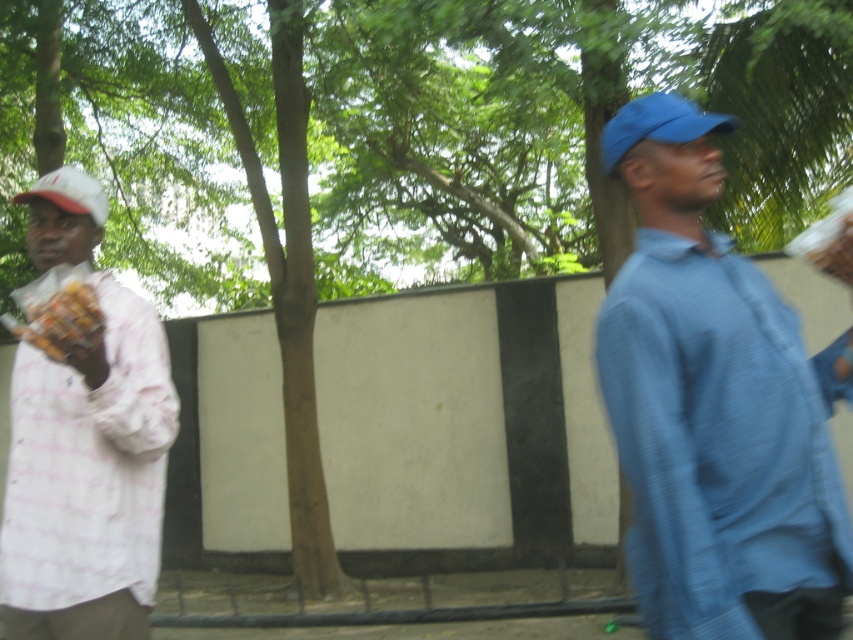
Question: Among these points, which one is nearest to the camera?

Choices:
 (A) (74, 300)
 (B) (751, 465)
 (C) (73, 449)
 (D) (618, 131)

Answer: (B)

Question: In this image, where is blue fabric shirt at right located relative to white checkered shirt at left?

Choices:
 (A) above
 (B) below

Answer: (A)

Question: Does blue fabric shirt at right have a lesser width compared to brown crumbly snack at left?

Choices:
 (A) yes
 (B) no

Answer: (B)

Question: Among these points, which one is farthest from the camera?

Choices:
 (A) (41, 512)
 (B) (77, 337)
 (C) (657, 100)
 (D) (73, 182)

Answer: (D)

Question: Which point is farther to the camera?

Choices:
 (A) blue fabric shirt at right
 (B) blue fabric cap at upper right

Answer: (B)

Question: Can you confirm if blue fabric shirt at right is wider than blue fabric cap at upper right?

Choices:
 (A) yes
 (B) no

Answer: (A)